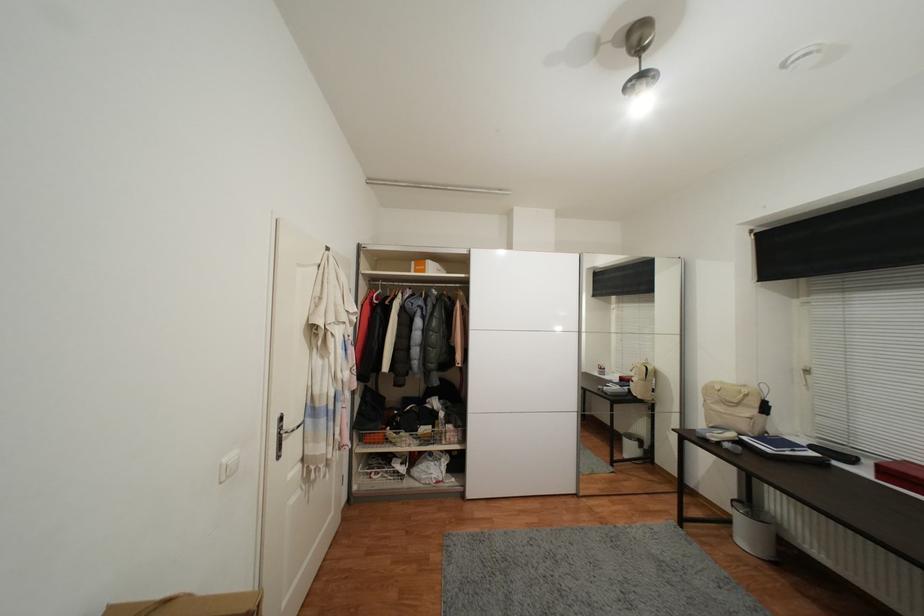
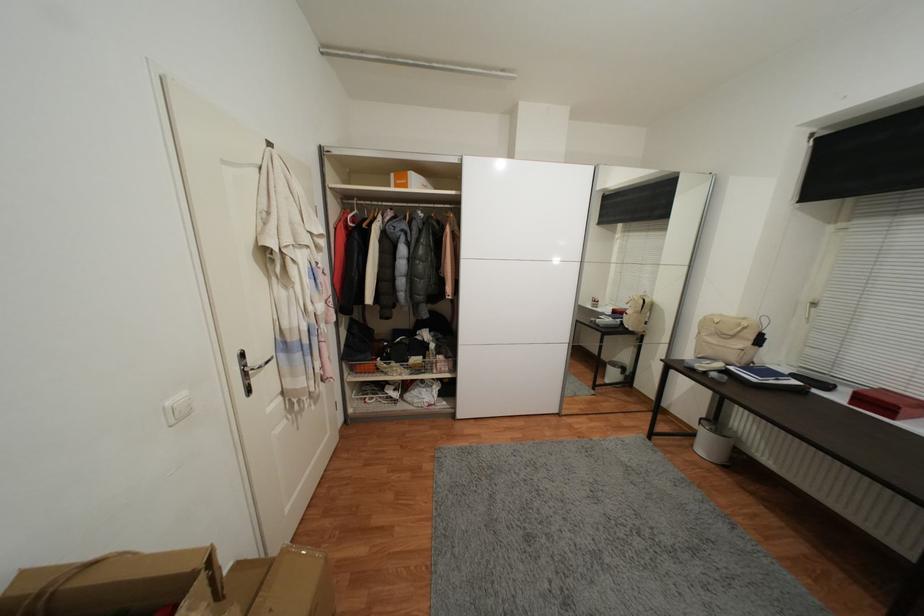
The point at [748,387] is marked in the first image. Where is the corresponding point in the second image?

(748, 321)